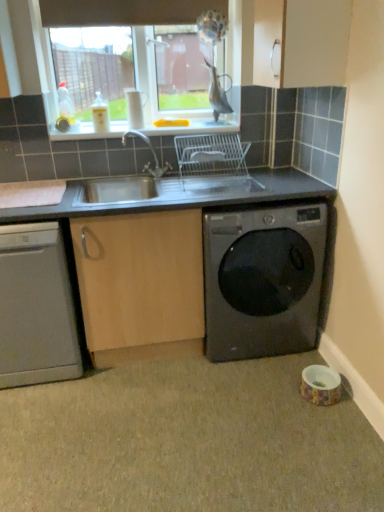
Question: Considering the relative sizes of black glossy washing machine at lower right and white plastic sink at upper center in the image provided, is black glossy washing machine at lower right smaller than white plastic sink at upper center?

Choices:
 (A) yes
 (B) no

Answer: (B)

Question: Is black glossy washing machine at lower right positioned before white plastic sink at upper center?

Choices:
 (A) yes
 (B) no

Answer: (A)

Question: Can you see black glossy washing machine at lower right touching white plastic sink at upper center?

Choices:
 (A) no
 (B) yes

Answer: (A)

Question: Can you confirm if black glossy washing machine at lower right is bigger than white plastic sink at upper center?

Choices:
 (A) yes
 (B) no

Answer: (A)

Question: Does black glossy washing machine at lower right turn towards white plastic sink at upper center?

Choices:
 (A) yes
 (B) no

Answer: (B)

Question: Choose the correct answer: Is gray matte granite at lower right inside satin silver dishwasher at lower left or outside it?

Choices:
 (A) outside
 (B) inside

Answer: (A)

Question: From a real-world perspective, is gray matte granite at lower right above or below satin silver dishwasher at lower left?

Choices:
 (A) below
 (B) above

Answer: (A)

Question: Looking at their shapes, would you say gray matte granite at lower right is wider or thinner than satin silver dishwasher at lower left?

Choices:
 (A) wide
 (B) thin

Answer: (A)

Question: Relative to satin silver dishwasher at lower left, is gray matte granite at lower right in front or behind?

Choices:
 (A) behind
 (B) front

Answer: (B)

Question: Visually, is white plastic sink at upper center positioned to the left or to the right of brown fabric exhaust hood at upper center?

Choices:
 (A) right
 (B) left

Answer: (A)

Question: From the image's perspective, relative to brown fabric exhaust hood at upper center, is white plastic sink at upper center above or below?

Choices:
 (A) below
 (B) above

Answer: (A)

Question: Is point (94, 132) positioned closer to the camera than point (139, 5)?

Choices:
 (A) closer
 (B) farther

Answer: (B)

Question: From their relative heights in the image, would you say white plastic sink at upper center is taller or shorter than brown fabric exhaust hood at upper center?

Choices:
 (A) short
 (B) tall

Answer: (A)

Question: Is brown fabric exhaust hood at upper center spatially inside white plastic sink at upper center, or outside of it?

Choices:
 (A) inside
 (B) outside

Answer: (B)

Question: In the image, is brown fabric exhaust hood at upper center positioned in front of or behind white plastic sink at upper center?

Choices:
 (A) front
 (B) behind

Answer: (A)